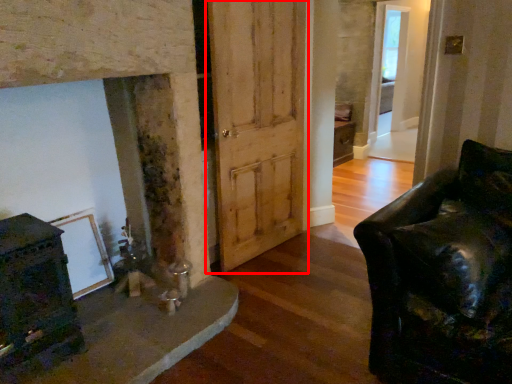
Question: Observing the image, what is the correct spatial positioning of barn door (annotated by the red box) in reference to glass door?

Choices:
 (A) right
 (B) left

Answer: (B)